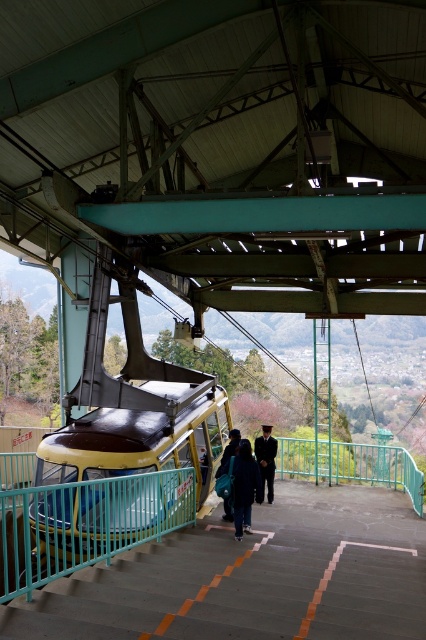
Can you confirm if dark blue fabric jacket at center is smaller than dark blue uniform at center?

No.

Measure the distance between dark blue fabric jacket at center and camera.

dark blue fabric jacket at center and camera are 10.15 meters apart.

Identify the location of dark blue fabric jacket at center. (244, 486).

Does dark blue fabric jacket at center have a greater height compared to black suit at center?

Indeed, dark blue fabric jacket at center has a greater height compared to black suit at center.

Who is positioned more to the left, dark blue fabric jacket at center or black suit at center?

dark blue fabric jacket at center

Does point (239, 476) come farther from viewer compared to point (259, 452)?

No, it is not.

Where is `dark blue fabric jacket at center`? This screenshot has height=640, width=426. dark blue fabric jacket at center is located at coordinates (244, 486).

Can you confirm if black suit at center is shorter than dark blue uniform at center?

Incorrect, black suit at center's height does not fall short of dark blue uniform at center's.

Which is behind, point (264, 429) or point (226, 460)?

The point (264, 429) is behind.

Find the location of a particular element. This screenshot has width=426, height=640. black suit at center is located at coordinates (265, 460).